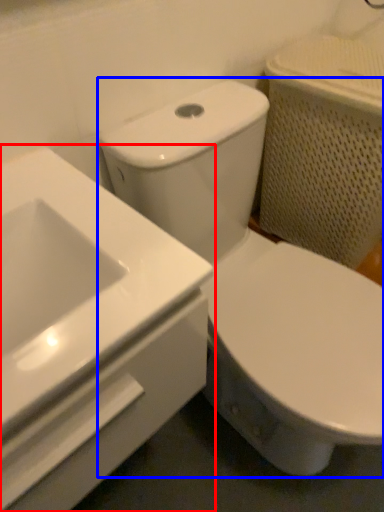
Question: Which point is further to the camera, sink (highlighted by a red box) or toilet (highlighted by a blue box)?

Choices:
 (A) sink
 (B) toilet

Answer: (B)